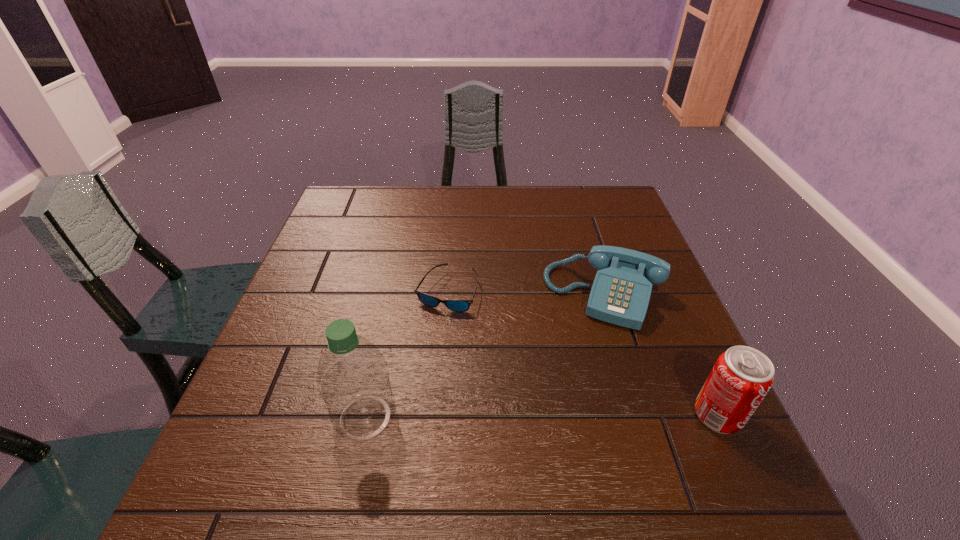
What are the coordinates of `free spot on the desktop that is between the water bottle and the soda can and is positioned at the front of the sunglasses showing the lenses` in the screenshot? It's located at (506, 416).

This screenshot has height=540, width=960. Identify the location of vacant space on the desktop that is between the tallest object and the second tallest object and is positioned on the dial of the telephone. (566, 416).